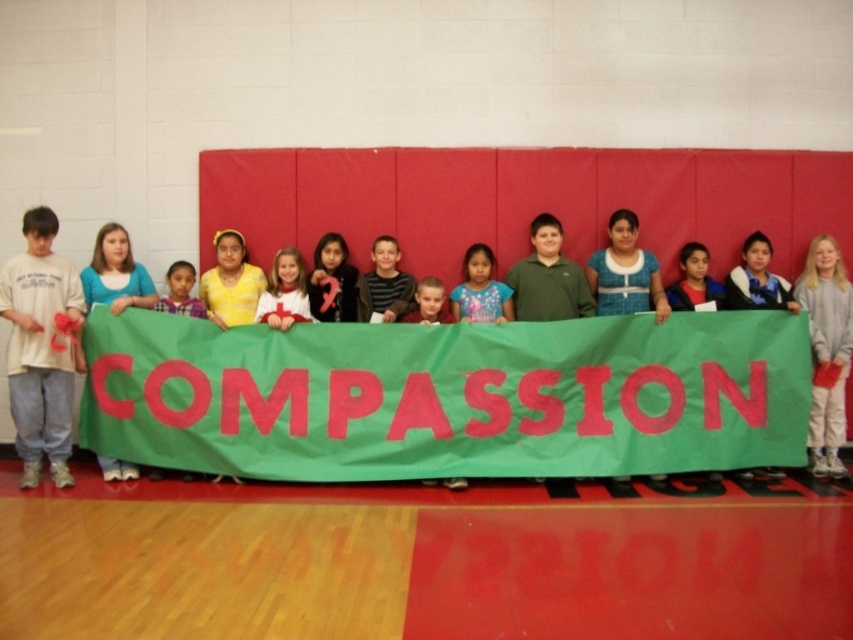
Question: Which point is closer to the camera?

Choices:
 (A) (490, 272)
 (B) (27, 470)
 (C) (171, 276)
 (D) (403, 321)

Answer: (B)

Question: Which of the following is the closest to the observer?

Choices:
 (A) (45, 372)
 (B) (437, 316)

Answer: (A)

Question: Is white cotton shirt at left to the right of striped cotton shirt at center from the viewer's perspective?

Choices:
 (A) no
 (B) yes

Answer: (A)

Question: Does yellow knit sweater at center lie behind smooth blue shirt at center?

Choices:
 (A) no
 (B) yes

Answer: (A)

Question: Which point appears farthest from the camera in this image?

Choices:
 (A) (273, 275)
 (B) (22, 257)
 (C) (432, 284)
 (D) (483, 246)

Answer: (D)

Question: Does yellow knit sweater at center have a larger size compared to smooth blue shirt at center?

Choices:
 (A) yes
 (B) no

Answer: (A)